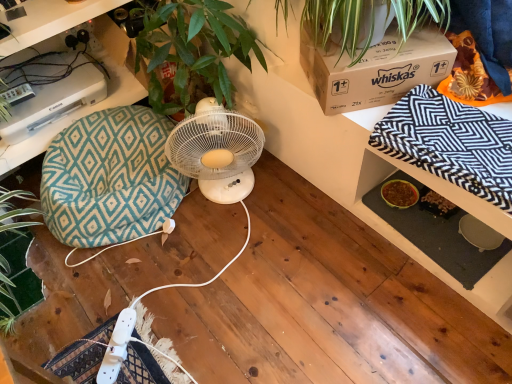
Question: From the image's perspective, is teal diamond-patterned bean bag chair at left above or below brown cardboard box at upper right?

Choices:
 (A) below
 (B) above

Answer: (A)

Question: Considering the positions of point (81, 236) and point (323, 87), is point (81, 236) closer or farther from the camera than point (323, 87)?

Choices:
 (A) closer
 (B) farther

Answer: (B)

Question: Which object is positioned farthest from the teal diamond-patterned bean bag chair at left?

Choices:
 (A) teal fabric cushion at left
 (B) white plastic fan at center
 (C) black and white zigzag blanket at upper right
 (D) brown cardboard box at upper right

Answer: (C)

Question: Considering the real-world distances, which object is farthest from the white plastic fan at center?

Choices:
 (A) teal fabric cushion at left
 (B) teal diamond-patterned bean bag chair at left
 (C) black and white zigzag blanket at upper right
 (D) brown cardboard box at upper right

Answer: (A)